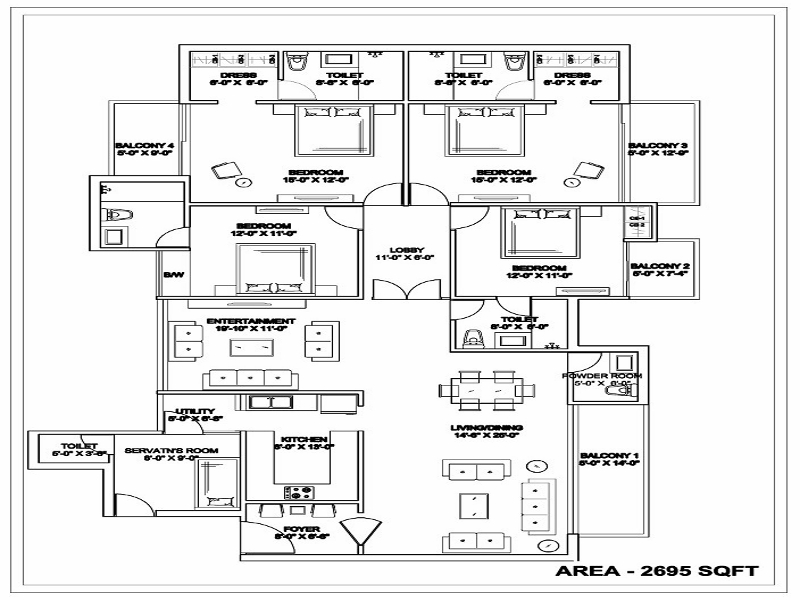
You are a GUI agent. You are given a task and a screenshot of the screen. Output one action in this format:
    pyautogui.click(x=<x>, y=<y>)
    Task: Click on the servants room
    
    Given the screenshot: What is the action you would take?
    pyautogui.click(x=178, y=447)